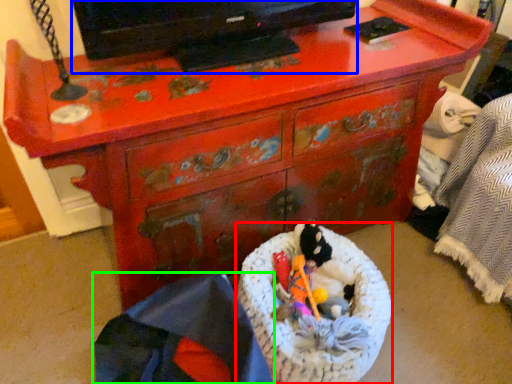
Question: Based on their relative distances, which object is nearer to laundry basket (highlighted by a red box)? Choose from television (highlighted by a blue box) and material (highlighted by a green box).

Choices:
 (A) television
 (B) material

Answer: (B)